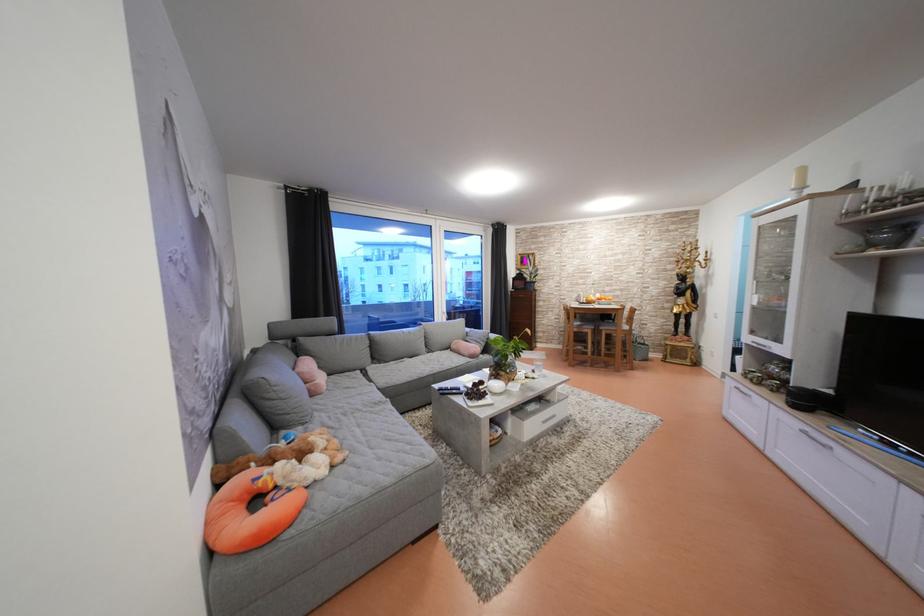
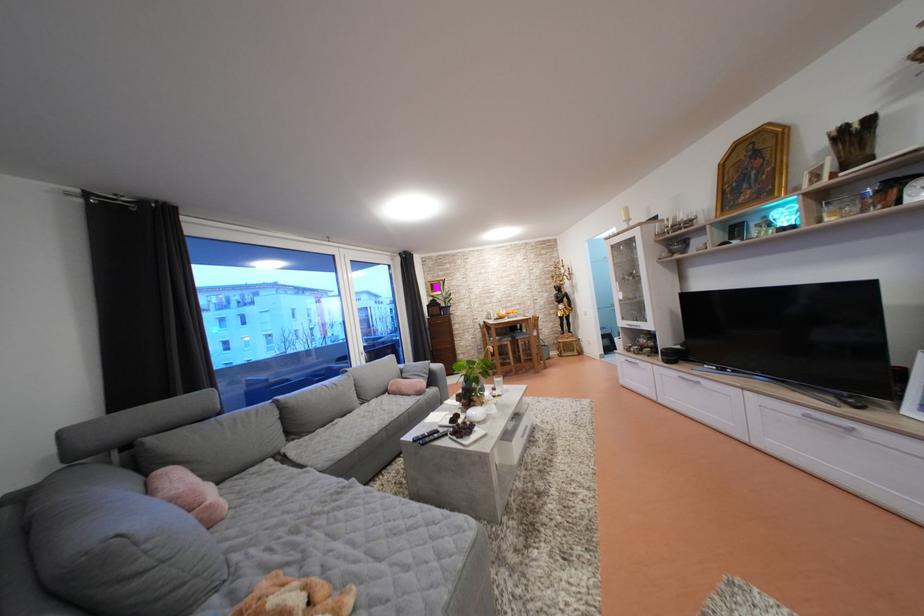
Where in the second image is the point corresponding to [473,390] from the first image?

(448, 429)